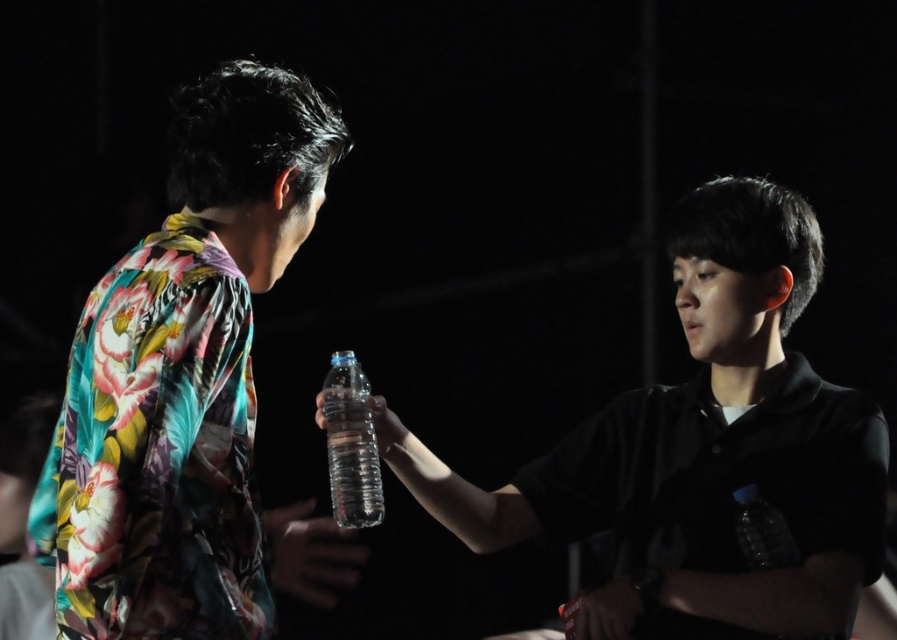
Question: Does transparent plastic water bottle at center appear on the left side of clear plastic bottle at center?

Choices:
 (A) yes
 (B) no

Answer: (B)

Question: Which of the following is the closest to the observer?

Choices:
 (A) (242, 294)
 (B) (392, 422)

Answer: (A)

Question: Can you confirm if clear plastic bottle at center is positioned below transparent plastic bottle at center?

Choices:
 (A) no
 (B) yes

Answer: (B)

Question: Which of the following is the closest to the observer?

Choices:
 (A) (332, 381)
 (B) (385, 460)

Answer: (A)

Question: Which object appears farthest from the camera in this image?

Choices:
 (A) floral-patterned shirt at left
 (B) transparent plastic water bottle at center

Answer: (B)

Question: Does transparent plastic water bottle at center appear over floral-patterned shirt at left?

Choices:
 (A) yes
 (B) no

Answer: (B)